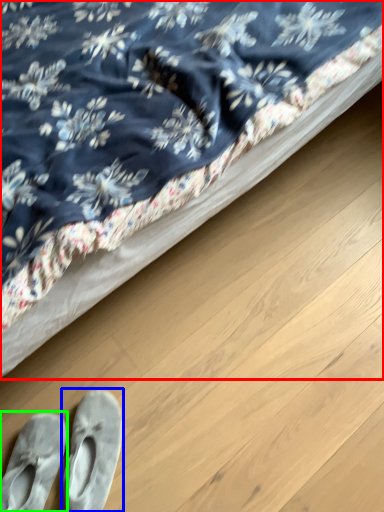
Question: Based on their relative distances, which object is farther from bed (highlighted by a red box)? Choose from footwear (highlighted by a blue box) and footwear (highlighted by a green box).

Choices:
 (A) footwear
 (B) footwear

Answer: (B)